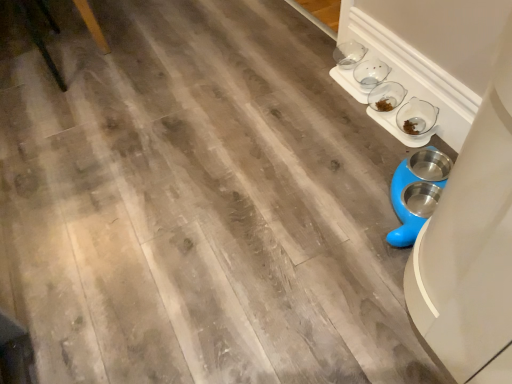
Where is `metallic silver chair at left`? The height and width of the screenshot is (384, 512). metallic silver chair at left is located at coordinates (39, 43).

Describe the element at coordinates (39, 43) in the screenshot. I see `metallic silver chair at left` at that location.

In order to click on metallic silver chair at left in this screenshot , I will do pyautogui.click(x=39, y=43).